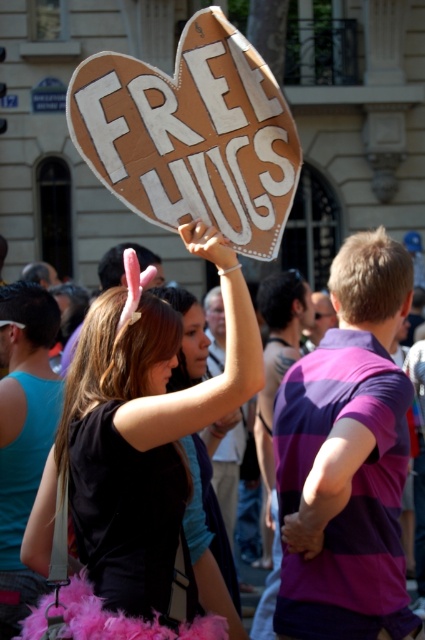
Question: Which of the following is the farthest from the observer?

Choices:
 (A) (190, 380)
 (B) (260, 81)

Answer: (A)

Question: Which point is farther to the camera?

Choices:
 (A) black feather boa at center
 (B) cardboard heart at center
 (C) matte cardboard sign at upper center
 (D) pink feather boa at upper center

Answer: (B)

Question: Among these objects, which one is nearest to the camera?

Choices:
 (A) matte pink feather at center
 (B) matte cardboard sign at upper center
 (C) black feather boa at center
 (D) pink feather boa at upper center

Answer: (D)

Question: Can you confirm if pink feather boa at upper center is bigger than matte cardboard sign at upper center?

Choices:
 (A) no
 (B) yes

Answer: (B)

Question: Where is cardboard heart at center located in relation to matte cardboard sign at upper center in the image?

Choices:
 (A) left
 (B) right

Answer: (A)

Question: Is pink feather boa at upper center closer to the viewer compared to matte pink feather at center?

Choices:
 (A) no
 (B) yes

Answer: (B)